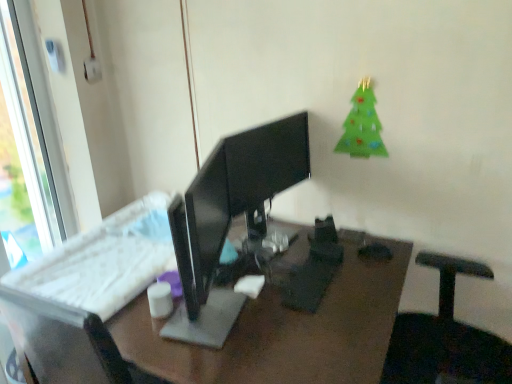
Identify the location of free space above white plastic keyboard at center (from a real-world perspective). (167, 269).